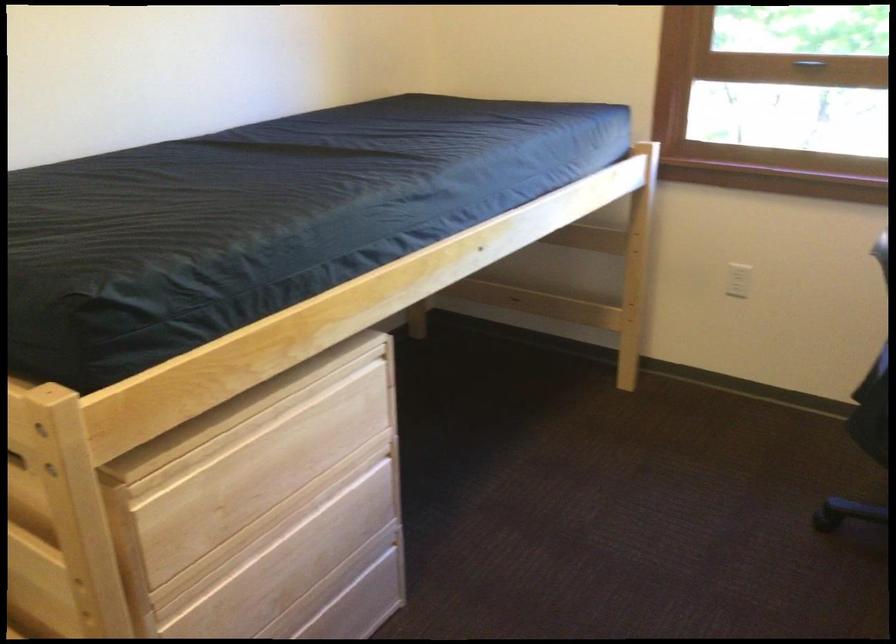
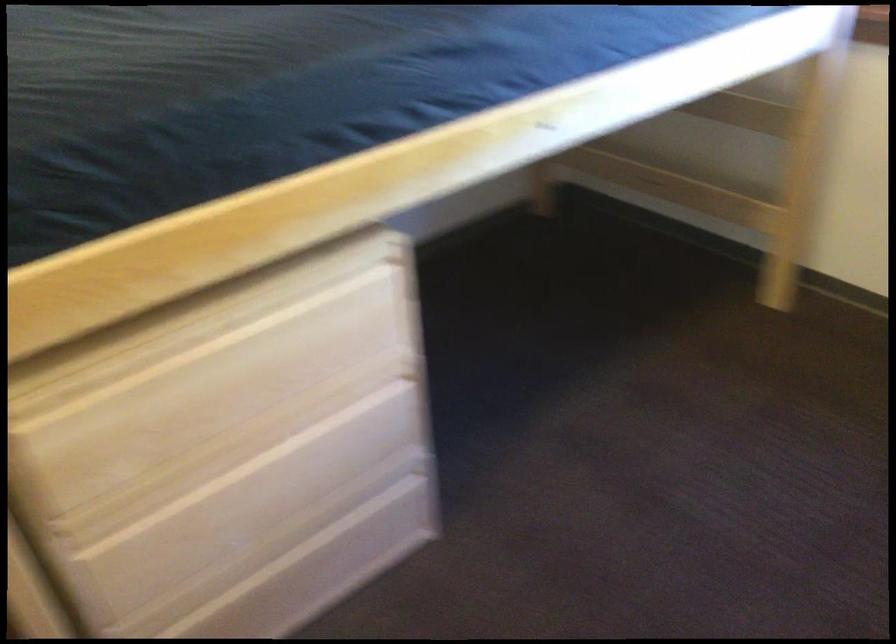
Which direction would the cameraman need to move to produce the second image?

The movement direction of the cameraman is right, forward.